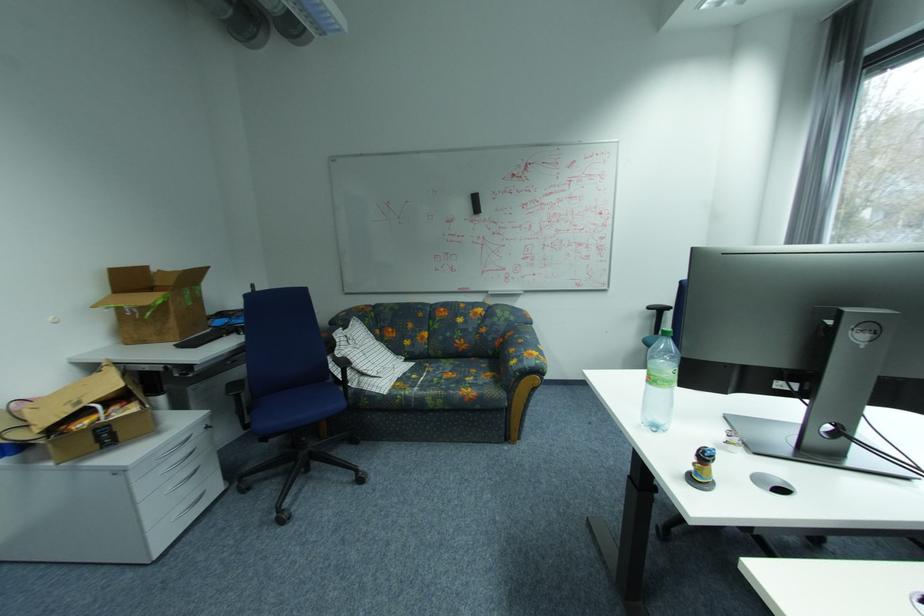
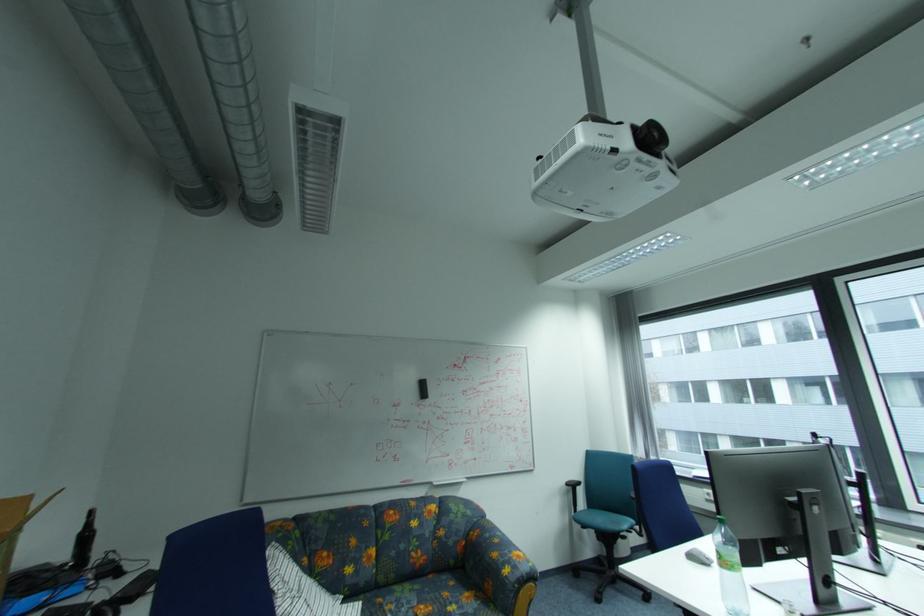
Find the pixel in the second image that matches point (658, 309) in the first image.

(576, 485)